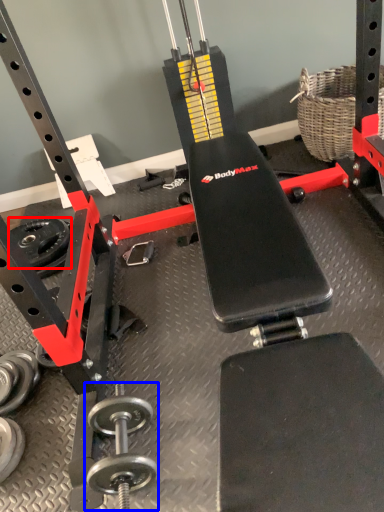
Question: Which object appears closest to the camera in this image, wheel (highlighted by a red box) or dumbbell (highlighted by a blue box)?

Choices:
 (A) wheel
 (B) dumbbell

Answer: (B)